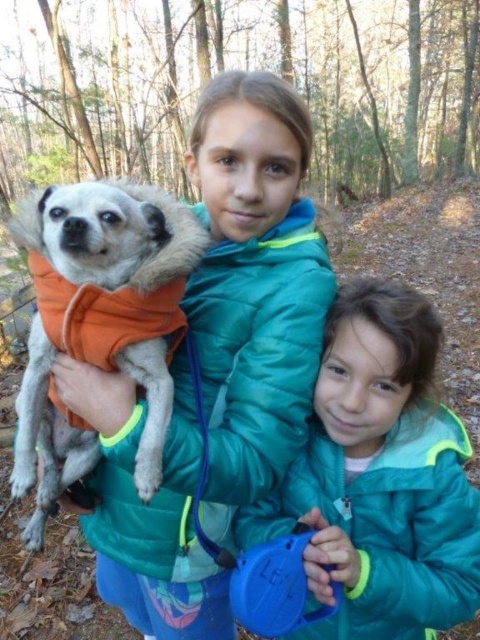
You are a photographer trying to capture a photo of the orange fleece dog at left and the teal puffer jacket at lower right. You want to ensure both subjects are in focus. Since you can only focus on one subject at a time, which one should you focus on first to ensure the other is also in focus?

You should focus on the teal puffer jacket at lower right first because it is further away from the camera than the orange fleece dog at left, so focusing on the further subject will keep the closer one in focus as well.

You are a photographer trying to capture a photo of the two children in the forest scene. You notice the teal puffer jacket at lower right and the orange fleece vest at left. Which piece of clothing should you focus on first if you want to capture both in the same frame without moving the camera?

The orange fleece vest at left should be focused on first because the teal puffer jacket at lower right is positioned below it, ensuring both will be in the frame when starting from the higher position.

You are a photographer trying to capture a candid shot of the two children and their dog in the forest. You notice the orange fleece dog at left and the orange fleece vest at left. Which one is closer to the camera?

The orange fleece dog at left is positioned under the orange fleece vest at left, meaning the dog is closer to the camera than the vest.